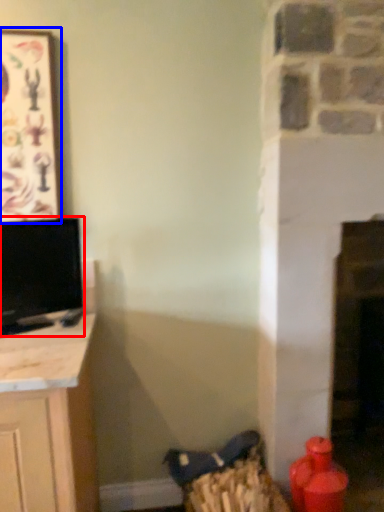
Question: Which object is further to the camera taking this photo, television (highlighted by a red box) or picture frame (highlighted by a blue box)?

Choices:
 (A) television
 (B) picture frame

Answer: (B)